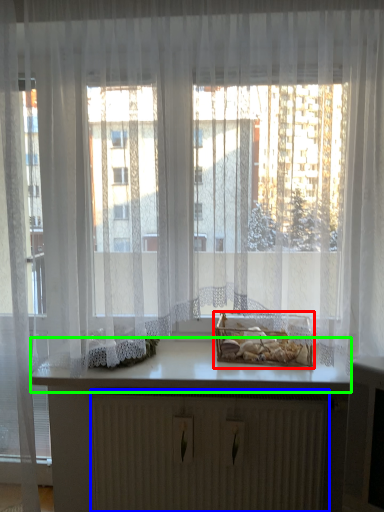
Question: Which object is positioned closest to window box (highlighted by a red box)? Select from radiator (highlighted by a blue box) and counter top (highlighted by a green box).

Choices:
 (A) radiator
 (B) counter top

Answer: (B)